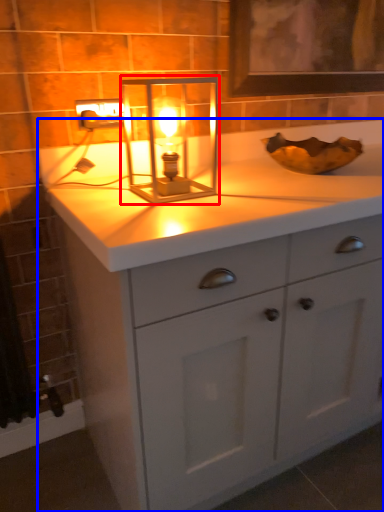
Question: Which of the following is the closest to the observer, candle holder (highlighted by a red box) or bathroom cabinet (highlighted by a blue box)?

Choices:
 (A) candle holder
 (B) bathroom cabinet

Answer: (B)